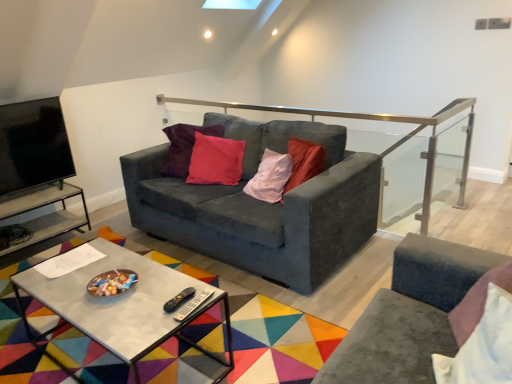
Where is `white soft pillow at lower right`? white soft pillow at lower right is located at coordinates (483, 346).

What do you see at coordinates (263, 205) in the screenshot? The height and width of the screenshot is (384, 512). I see `velvet dark gray couch at center` at bounding box center [263, 205].

At what (x,y) coordinates should I click in order to perform the action: click on satin silver rail at upper center. Please return your answer as a coordinate pair (x, y). This screenshot has width=512, height=384. Looking at the image, I should click on (378, 120).

Locate an element on the screen. The image size is (512, 384). white soft pillow at lower right is located at coordinates click(483, 346).

Between metal/glass side table at left and matte black tv stand at left, which one has larger size?

metal/glass side table at left is bigger.

In the scene shown: From the image's perspective, which one is positioned lower, metal/glass side table at left or matte black tv stand at left?

From the image's view, metal/glass side table at left is below.

Is metal/glass side table at left directly adjacent to matte black tv stand at left?

No, metal/glass side table at left is not touching matte black tv stand at left.

Is matte black tv stand at left inside metal/glass side table at left?

That's incorrect, matte black tv stand at left is not inside metal/glass side table at left.

Between white soft pillow at lower right and matte black tv stand at left, which one has less height?

Standing shorter between the two is white soft pillow at lower right.

From the image's perspective, relative to matte black tv stand at left, is white soft pillow at lower right above or below?

Based on their image positions, white soft pillow at lower right is located beneath matte black tv stand at left.

Is white soft pillow at lower right not inside matte black tv stand at left?

Indeed, white soft pillow at lower right is completely outside matte black tv stand at left.

Is white soft pillow at lower right far from matte black tv stand at left?

Yes.

Which is in front, white soft pillow at lower right or satin silver rail at upper center?

white soft pillow at lower right is closer to the camera.

From the image's perspective, is white soft pillow at lower right above satin silver rail at upper center?

No.

Considering the relative sizes of white soft pillow at lower right and satin silver rail at upper center in the image provided, is white soft pillow at lower right taller than satin silver rail at upper center?

In fact, white soft pillow at lower right may be shorter than satin silver rail at upper center.

Is white soft pillow at lower right not close to satin silver rail at upper center?

Yes, white soft pillow at lower right and satin silver rail at upper center are located far from each other.

Is white soft pillow at lower right situated inside concrete rectangular table at center or outside?

white soft pillow at lower right exists outside the volume of concrete rectangular table at center.

Considering the sizes of objects white soft pillow at lower right and concrete rectangular table at center in the image provided, who is shorter, white soft pillow at lower right or concrete rectangular table at center?

Standing shorter between the two is concrete rectangular table at center.

Does point (437, 374) lie in front of point (129, 342)?

Yes, it is in front of point (129, 342).

Visually, is white soft pillow at lower right positioned to the left or to the right of concrete rectangular table at center?

From the image, it's evident that white soft pillow at lower right is to the right of concrete rectangular table at center.

In the scene shown: From the image's perspective, is white soft pillow at lower right below metal/glass side table at left?

Yes, from the image's perspective, white soft pillow at lower right is below metal/glass side table at left.

Is metal/glass side table at left at the back of white soft pillow at lower right?

No, white soft pillow at lower right is not facing the opposite direction of metal/glass side table at left.

Can you see white soft pillow at lower right touching metal/glass side table at left?

No, white soft pillow at lower right is not touching metal/glass side table at left.

Can you confirm if concrete rectangular table at center is positioned to the left of metal/glass side table at left?

No, concrete rectangular table at center is not to the left of metal/glass side table at left.

What are the coordinates of `side table behind the concrete rectangular table at center` in the screenshot? It's located at (45, 215).

From a real-world perspective, is concrete rectangular table at center physically above metal/glass side table at left?

Yes, from a real-world perspective, concrete rectangular table at center is above metal/glass side table at left.

Between matte black tv stand at left and satin silver rail at upper center, which one appears on the left side from the viewer's perspective?

matte black tv stand at left.

What are the coordinates of `entertainment center above the satin silver rail at upper center (from the image's perspective)` in the screenshot? It's located at (37, 169).

How distant is matte black tv stand at left from satin silver rail at upper center?

The distance of matte black tv stand at left from satin silver rail at upper center is 2.58 meters.

Which of these two, matte black tv stand at left or satin silver rail at upper center, is thinner?

Thinner between the two is satin silver rail at upper center.

Where is `entertainment center above the metal/glass side table at left (from a real-world perspective)`? entertainment center above the metal/glass side table at left (from a real-world perspective) is located at coordinates (37, 169).

What are the coordinates of `pillow that is below the matte black tv stand at left (from the image's perspective)` in the screenshot? It's located at (483, 346).

Based on their spatial positions, is velvet dark gray couch at center or metal/glass side table at left closer to white soft pillow at lower right?

Based on the image, velvet dark gray couch at center appears to be nearer to white soft pillow at lower right.

Which object lies further to the anchor point velvet dark gray couch at center, white soft pillow at lower right or matte black tv stand at left?

Based on the image, white soft pillow at lower right appears to be further to velvet dark gray couch at center.

Considering their positions, is satin silver rail at upper center positioned closer to velvet dark gray couch at center than metal/glass side table at left?

The object closer to velvet dark gray couch at center is satin silver rail at upper center.

Estimate the real-world distances between objects in this image. Which object is further from satin silver rail at upper center, concrete rectangular table at center or matte black tv stand at left?

The object further to satin silver rail at upper center is matte black tv stand at left.

From the image, which object appears to be nearer to metal/glass side table at left, white soft pillow at lower right or concrete rectangular table at center?

Among the two, concrete rectangular table at center is located nearer to metal/glass side table at left.

From the image, which object appears to be nearer to concrete rectangular table at center, matte black tv stand at left or satin silver rail at upper center?

Based on the image, matte black tv stand at left appears to be nearer to concrete rectangular table at center.

When comparing their distances from velvet dark gray couch at center, does metal/glass side table at left or matte black tv stand at left seem further?

metal/glass side table at left is further to velvet dark gray couch at center.

Based on the photo, based on their spatial positions, is satin silver rail at upper center or white soft pillow at lower right closer to metal/glass side table at left?

satin silver rail at upper center is positioned closer to the anchor metal/glass side table at left.

At what (x,y) coordinates should I click in order to perform the action: click on entertainment center between metal/glass side table at left and white soft pillow at lower right from left to right. Please return your answer as a coordinate pair (x, y). Looking at the image, I should click on (37, 169).

What are the coordinates of `entertainment center between metal/glass side table at left and satin silver rail at upper center from left to right` in the screenshot? It's located at (37, 169).

At what (x,y) coordinates should I click in order to perform the action: click on coffee table located between metal/glass side table at left and white soft pillow at lower right in the left-right direction. Please return your answer as a coordinate pair (x, y). This screenshot has width=512, height=384. Looking at the image, I should click on (121, 305).

Where is `studio couch positioned between concrete rectangular table at center and satin silver rail at upper center from near to far`? Image resolution: width=512 pixels, height=384 pixels. studio couch positioned between concrete rectangular table at center and satin silver rail at upper center from near to far is located at coordinates (263, 205).